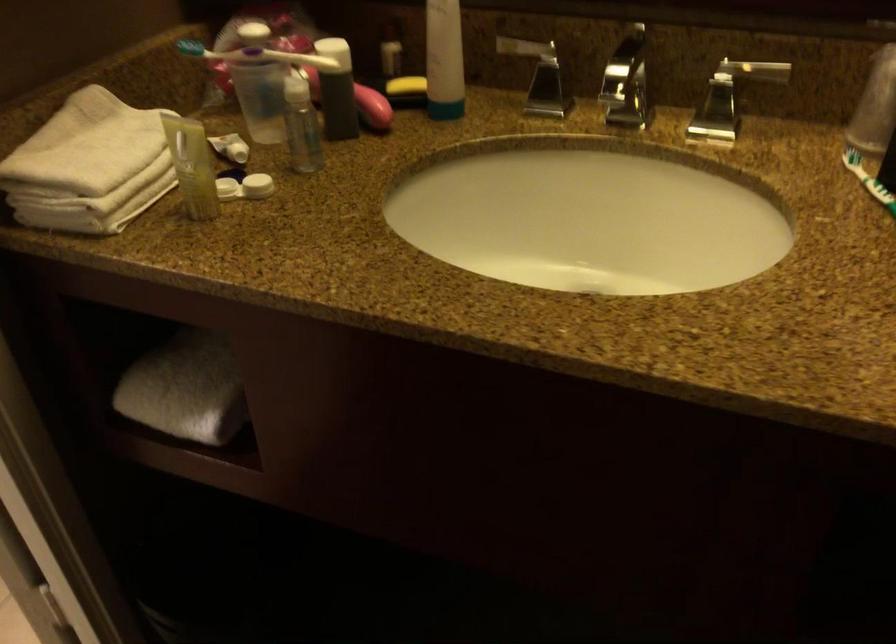
Identify the location of green lotion tube. (300, 125).